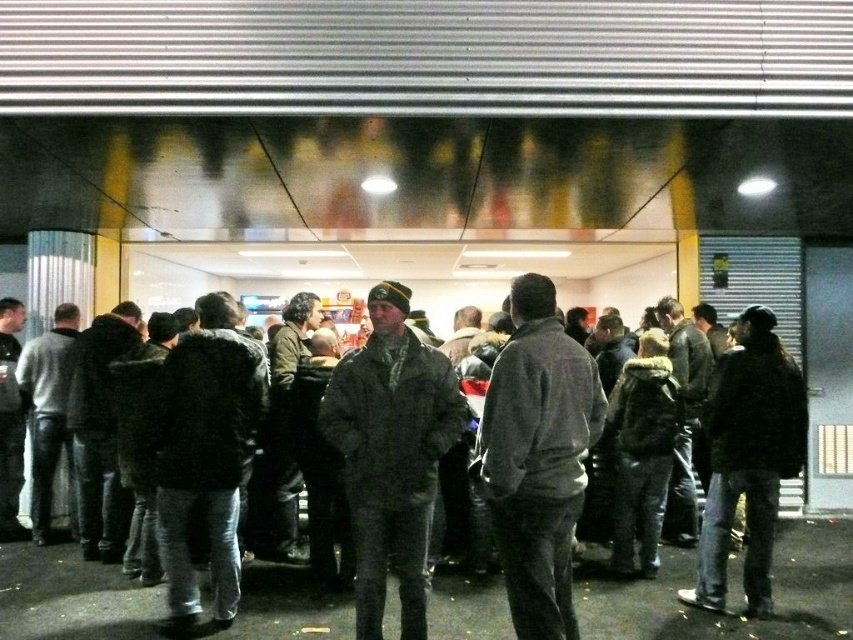
How much distance is there between camouflage jacket at center and dark brown leather jacket at right?

The distance of camouflage jacket at center from dark brown leather jacket at right is 5.35 feet.

Between camouflage jacket at center and dark brown leather jacket at right, which one has more height?

dark brown leather jacket at right

Where is `camouflage jacket at center`? This screenshot has height=640, width=853. camouflage jacket at center is located at coordinates (392, 454).

Locate an element on the screen. The width and height of the screenshot is (853, 640). camouflage jacket at center is located at coordinates (392, 454).

Between dark gray jacket at center and camouflage jacket at center, which one has more height?

With more height is camouflage jacket at center.

Between dark gray jacket at center and camouflage jacket at center, which one appears on the left side from the viewer's perspective?

camouflage jacket at center is more to the left.

Is point (490, 493) in front of point (422, 381)?

Yes, it is in front of point (422, 381).

Identify the location of dark gray jacket at center. (538, 458).

Does dark gray jacket at center appear over dark brown leather jacket at right?

Correct, dark gray jacket at center is located above dark brown leather jacket at right.

Is point (512, 301) positioned behind point (749, 506)?

No, (512, 301) is closer to viewer.

You are a GUI agent. You are given a task and a screenshot of the screen. Output one action in this format:
    pyautogui.click(x=<x>, y=<y>)
    Task: Click on the dark gray jacket at center
    
    Given the screenshot: What is the action you would take?
    pyautogui.click(x=538, y=458)